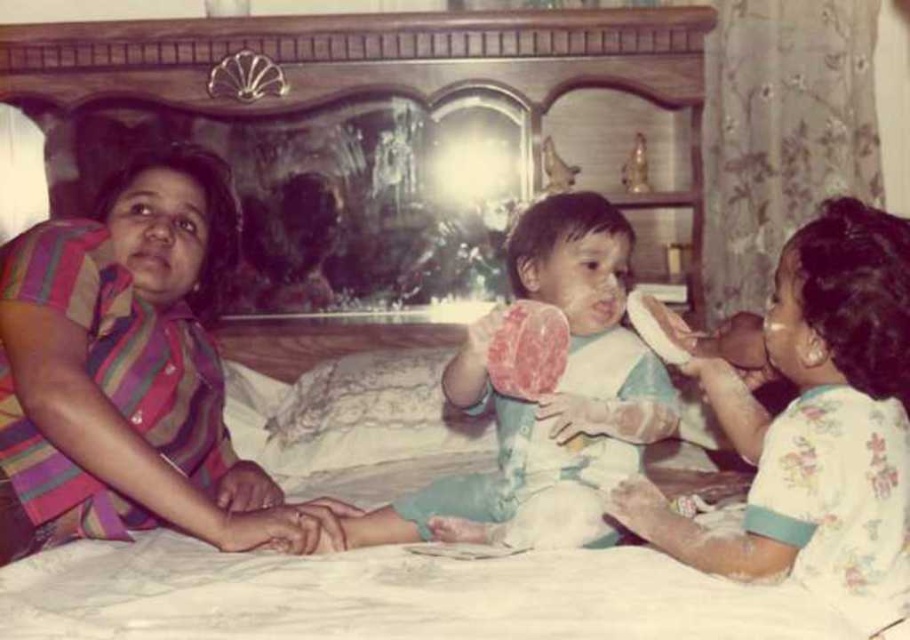
Question: Among these points, which one is nearest to the camera?

Choices:
 (A) (642, 499)
 (B) (513, 444)

Answer: (A)

Question: Estimate the real-world distances between objects in this image. Which object is farther from the white cotton shirt at center?

Choices:
 (A) striped fabric shirt at left
 (B) white cotton bib at center

Answer: (A)

Question: Is the position of white cotton shirt at center more distant than that of white cotton bib at center?

Choices:
 (A) yes
 (B) no

Answer: (B)

Question: Is white cotton shirt at center closer to camera compared to white cotton bib at center?

Choices:
 (A) yes
 (B) no

Answer: (A)

Question: Can you confirm if striped fabric shirt at left is thinner than white cotton bib at center?

Choices:
 (A) no
 (B) yes

Answer: (B)

Question: Which object is the closest to the white cotton shirt at center?

Choices:
 (A) striped fabric shirt at left
 (B) white cotton bib at center

Answer: (B)